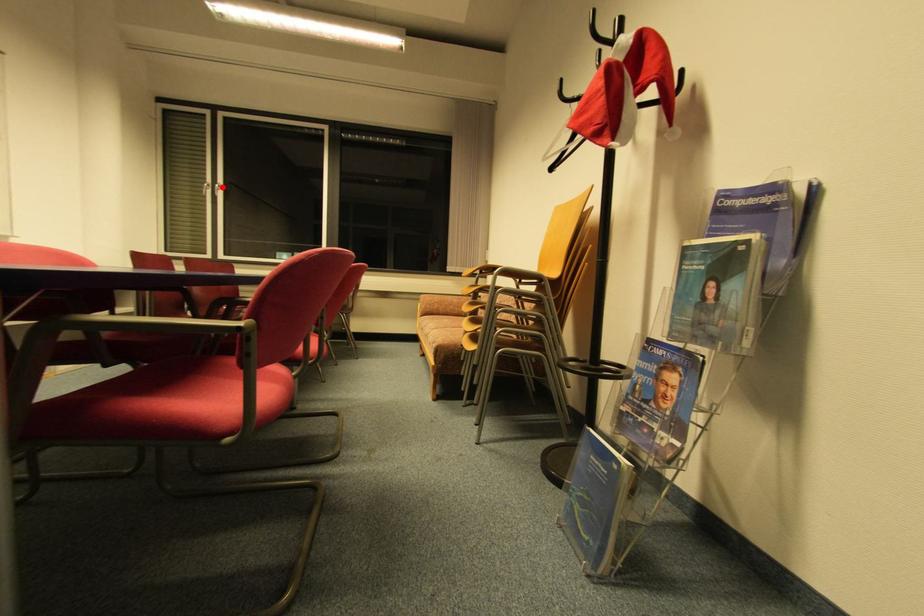
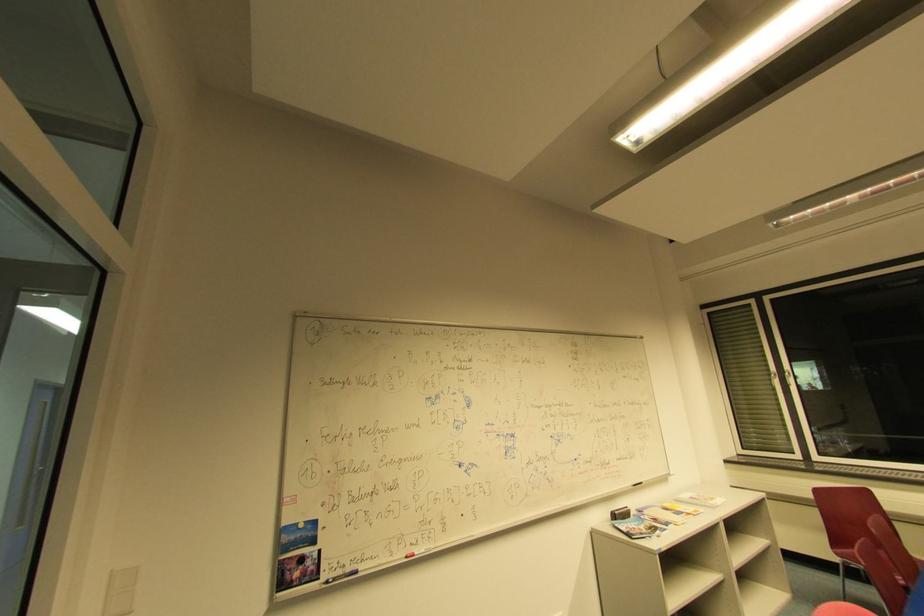
Question: I am providing you with two images of the same scene from different viewpoints. Given a red point in image1, look at the same physical point in image2. Is it:

Choices:
 (A) Closer to the viewpoint
 (B) Farther from the viewpoint

Answer: (A)